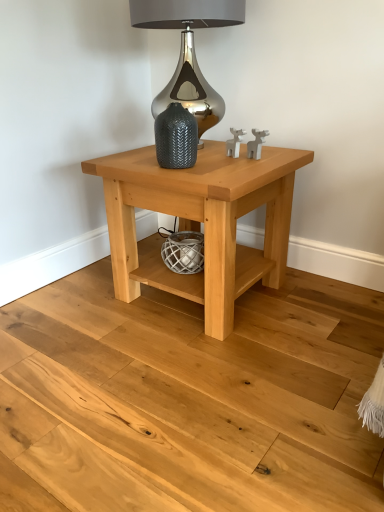
Locate an element on the screen. The image size is (384, 512). vacant area that is in front of textured gray vase at center is located at coordinates (189, 177).